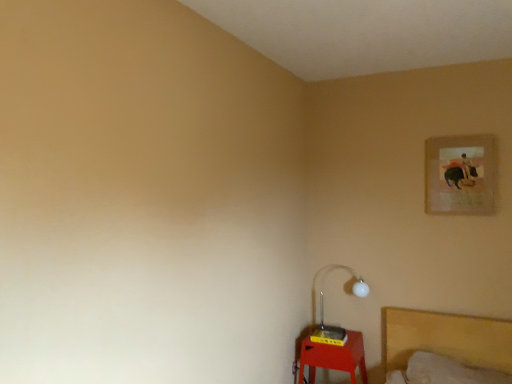
Question: Considering the relative positions of yellow plastic table at lower right and matte paper picture frame at upper right in the image provided, is yellow plastic table at lower right to the left of matte paper picture frame at upper right from the viewer's perspective?

Choices:
 (A) yes
 (B) no

Answer: (A)

Question: Considering the relative sizes of yellow plastic table at lower right and matte paper picture frame at upper right in the image provided, is yellow plastic table at lower right shorter than matte paper picture frame at upper right?

Choices:
 (A) yes
 (B) no

Answer: (A)

Question: Can we say yellow plastic table at lower right lies outside matte paper picture frame at upper right?

Choices:
 (A) yes
 (B) no

Answer: (A)

Question: Is yellow plastic table at lower right far from matte paper picture frame at upper right?

Choices:
 (A) no
 (B) yes

Answer: (B)

Question: Is yellow plastic table at lower right closer to camera compared to matte paper picture frame at upper right?

Choices:
 (A) no
 (B) yes

Answer: (A)

Question: Visually, is white glossy lamp at lower right positioned to the left or to the right of matte paper picture frame at upper right?

Choices:
 (A) left
 (B) right

Answer: (A)

Question: Considering the positions of white glossy lamp at lower right and matte paper picture frame at upper right in the image, is white glossy lamp at lower right wider or thinner than matte paper picture frame at upper right?

Choices:
 (A) wide
 (B) thin

Answer: (A)

Question: From the image's perspective, is white glossy lamp at lower right above or below matte paper picture frame at upper right?

Choices:
 (A) above
 (B) below

Answer: (B)

Question: From a real-world perspective, is white glossy lamp at lower right physically located above or below matte paper picture frame at upper right?

Choices:
 (A) above
 (B) below

Answer: (B)

Question: From a real-world perspective, is matte paper picture frame at upper right above or below yellow plastic table at lower right?

Choices:
 (A) above
 (B) below

Answer: (A)

Question: Do you think matte paper picture frame at upper right is within yellow plastic table at lower right, or outside of it?

Choices:
 (A) inside
 (B) outside

Answer: (B)

Question: From the image's perspective, relative to yellow plastic table at lower right, is matte paper picture frame at upper right above or below?

Choices:
 (A) above
 (B) below

Answer: (A)

Question: From their relative heights in the image, would you say matte paper picture frame at upper right is taller or shorter than yellow plastic table at lower right?

Choices:
 (A) short
 (B) tall

Answer: (B)

Question: Would you say yellow plastic table at lower right is to the left or to the right of white glossy lamp at lower right in the picture?

Choices:
 (A) left
 (B) right

Answer: (A)

Question: Is yellow plastic table at lower right in front of or behind white glossy lamp at lower right in the image?

Choices:
 (A) front
 (B) behind

Answer: (A)